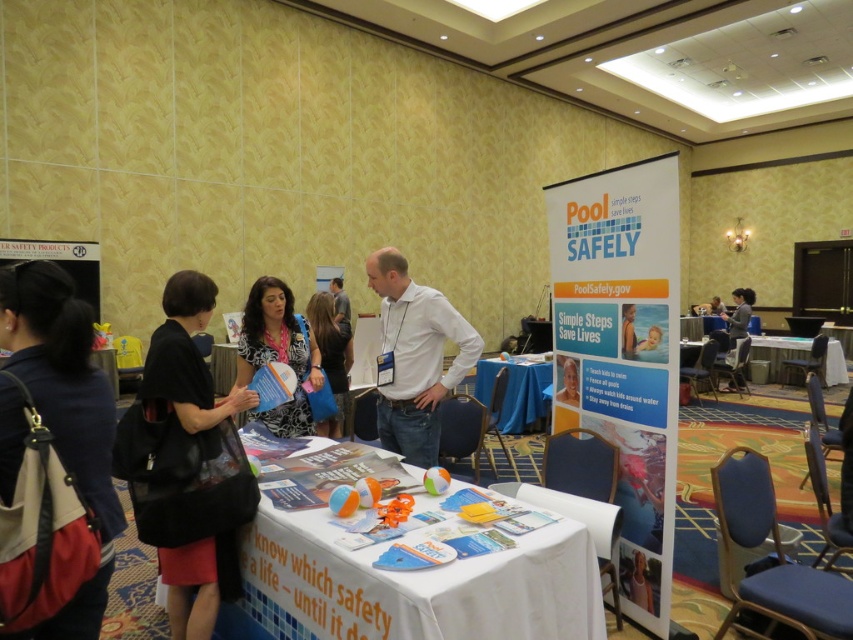
Who is more forward, [56,420] or [173,579]?

Positioned in front is point [56,420].

Which of these two, red leather backpack at left or black leather bag at left, stands taller?

black leather bag at left

Is point (0, 493) in front of point (209, 291)?

Yes, point (0, 493) is closer to viewer.

At what (x,y) coordinates should I click in order to perform the action: click on red leather backpack at left. Please return your answer as a coordinate pair (x, y). This screenshot has height=640, width=853. Looking at the image, I should click on (62, 376).

Which is above, white plastic table at lower right or matte white shirt at center?

Positioned higher is matte white shirt at center.

Does white plastic table at lower right have a larger size compared to matte white shirt at center?

Correct, white plastic table at lower right is larger in size than matte white shirt at center.

Which is in front, point (799, 346) or point (577, 369)?

Point (577, 369) is more forward.

Locate an element on the screen. white plastic table at lower right is located at coordinates (778, 353).

Does red leather backpack at left have a larger size compared to white plastic table at lower right?

No, red leather backpack at left is not bigger than white plastic table at lower right.

Which is more to the left, red leather backpack at left or white plastic table at lower right?

Positioned to the left is red leather backpack at left.

Locate an element on the screen. Image resolution: width=853 pixels, height=640 pixels. red leather backpack at left is located at coordinates (62, 376).